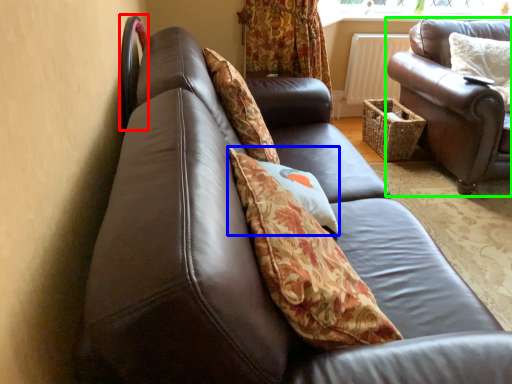
Question: Considering the real-world distances, which object is farthest from chair (highlighted by a red box)? pillow (highlighted by a blue box) or studio couch (highlighted by a green box)?

Choices:
 (A) pillow
 (B) studio couch

Answer: (B)